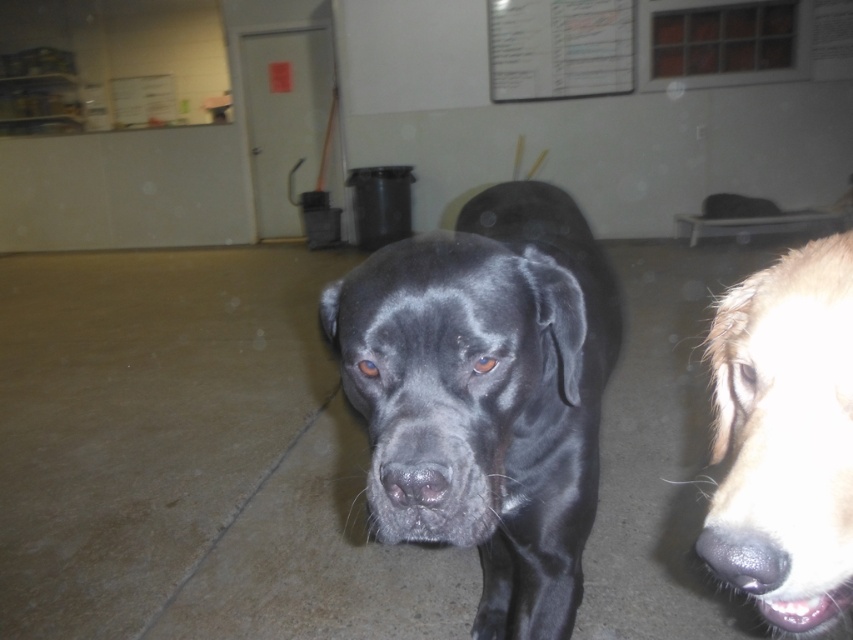
Question: Which of these objects is positioned closest to the shiny black dog at center?

Choices:
 (A) shiny golden fur at center
 (B) white paper at upper center

Answer: (A)

Question: Can you confirm if shiny golden fur at center is bigger than white paper at upper center?

Choices:
 (A) yes
 (B) no

Answer: (B)

Question: Does shiny golden fur at center lie behind white paper at upper center?

Choices:
 (A) yes
 (B) no

Answer: (B)

Question: Can you confirm if shiny golden fur at center is positioned to the left of white paper at upper center?

Choices:
 (A) no
 (B) yes

Answer: (B)

Question: Estimate the real-world distances between objects in this image. Which object is farther from the shiny golden fur at center?

Choices:
 (A) white paper at upper center
 (B) shiny black dog at center

Answer: (A)

Question: Which object appears closest to the camera in this image?

Choices:
 (A) shiny golden fur at center
 (B) white paper at upper center
 (C) shiny black dog at center

Answer: (A)